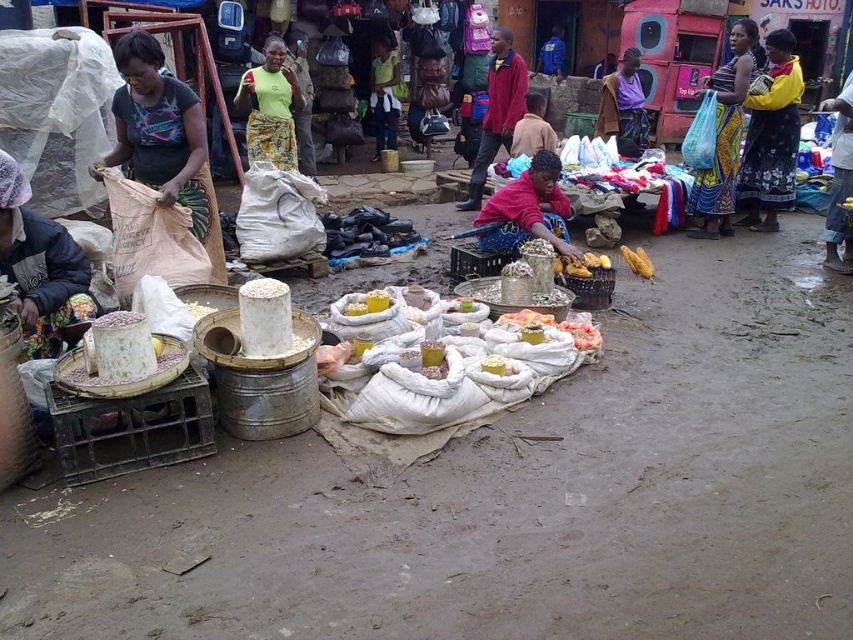
Is brown paper bag at left to the right of yellow corn at center from the viewer's perspective?

Incorrect, brown paper bag at left is not on the right side of yellow corn at center.

The width and height of the screenshot is (853, 640). Describe the element at coordinates (163, 140) in the screenshot. I see `brown paper bag at left` at that location.

Describe the element at coordinates (163, 140) in the screenshot. I see `brown paper bag at left` at that location.

Where is `brown paper bag at left`? This screenshot has height=640, width=853. brown paper bag at left is located at coordinates (163, 140).

Between point (285, 100) and point (619, 248), which one is positioned in front?

Positioned in front is point (619, 248).

This screenshot has width=853, height=640. What are the coordinates of `yellow printed fabric at center` in the screenshot? It's located at (270, 108).

Is yellow smooth corn at center taller than yellow corn at center?

No, yellow smooth corn at center is not taller than yellow corn at center.

Does yellow smooth corn at center come behind yellow corn at center?

That is False.

Between point (558, 273) and point (651, 275), which one is positioned behind?

Positioned behind is point (651, 275).

The height and width of the screenshot is (640, 853). I want to click on yellow smooth corn at center, so click(582, 266).